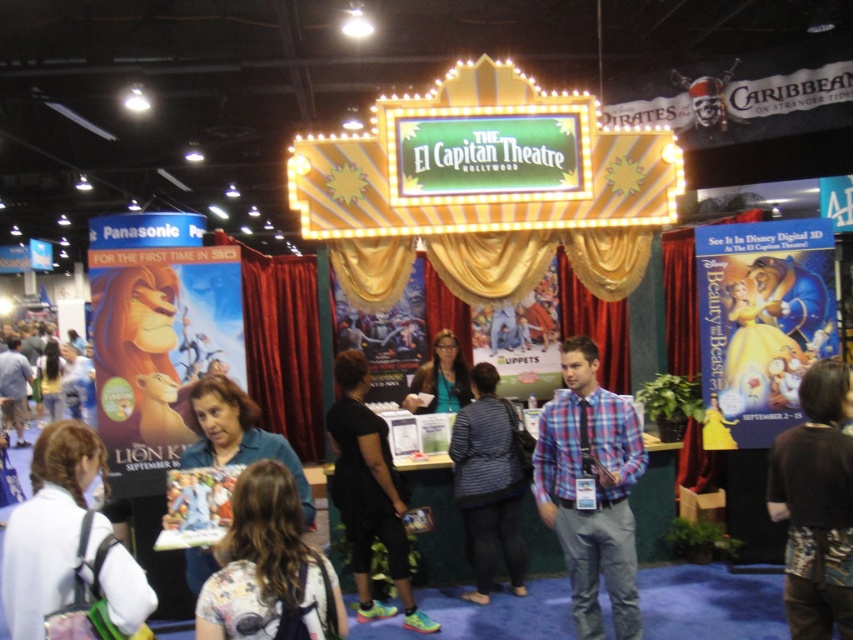
Which is in front, point (842, 474) or point (428, 401)?

Point (842, 474) is more forward.

From the picture: Does brown fabric pants at lower right appear under matte green shirt at center?

Yes.

Is point (810, 547) farther from camera compared to point (437, 346)?

No, (810, 547) is closer to viewer.

Where is `brown fabric pants at lower right`? The width and height of the screenshot is (853, 640). brown fabric pants at lower right is located at coordinates (816, 504).

Which is above, black fabric dress at center or matte green shirt at center?

matte green shirt at center is above.

Is black fabric dress at center further to camera compared to matte green shirt at center?

No, black fabric dress at center is in front of matte green shirt at center.

Is point (357, 376) positioned after point (440, 403)?

No.

Find the location of a particular element. Image resolution: width=853 pixels, height=640 pixels. black fabric dress at center is located at coordinates (368, 492).

Does striped fabric shirt at center come in front of matte green shirt at center?

Yes.

Between point (486, 509) and point (422, 371), which one is positioned in front?

Point (486, 509) is more forward.

Locate an element on the screen. striped fabric shirt at center is located at coordinates [488, 483].